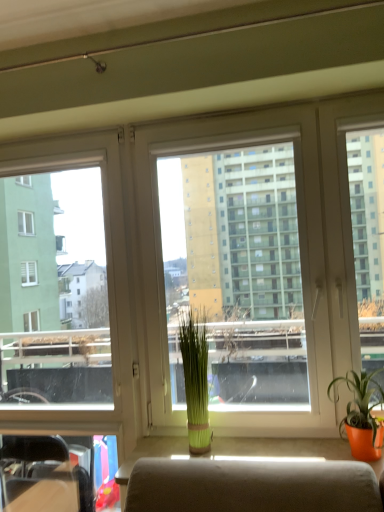
Question: Does transparent plastic window screen at center appear on the left side of green matte plant at center, which ranks as the 2th houseplant in right-to-left order?

Choices:
 (A) no
 (B) yes

Answer: (A)

Question: Is transparent plastic window screen at center to the right of green matte plant at center, the first houseplant viewed from the back, from the viewer's perspective?

Choices:
 (A) yes
 (B) no

Answer: (A)

Question: Is green matte plant at center, which ranks as the 2th houseplant in right-to-left order, inside transparent plastic window screen at center?

Choices:
 (A) yes
 (B) no

Answer: (B)

Question: Can you confirm if transparent plastic window screen at center is bigger than green matte plant at center, the first houseplant viewed from the back?

Choices:
 (A) no
 (B) yes

Answer: (B)

Question: Would you say transparent plastic window screen at center is a long distance from green matte plant at center, marked as the second houseplant in a front-to-back arrangement?

Choices:
 (A) no
 (B) yes

Answer: (A)

Question: From the image's perspective, is transparent plastic window screen at center above or below transparent glass window at left?

Choices:
 (A) below
 (B) above

Answer: (B)

Question: Would you say transparent plastic window screen at center is to the left or to the right of transparent glass window at left in the picture?

Choices:
 (A) left
 (B) right

Answer: (B)

Question: Considering the positions of transparent plastic window screen at center and transparent glass window at left in the image, is transparent plastic window screen at center taller or shorter than transparent glass window at left?

Choices:
 (A) tall
 (B) short

Answer: (B)

Question: From a real-world perspective, is transparent plastic window screen at center positioned above or below transparent glass window at left?

Choices:
 (A) above
 (B) below

Answer: (A)

Question: Looking at their shapes, would you say transparent glass window at left is wider or thinner than green matte plant at center, the first houseplant viewed from the back?

Choices:
 (A) thin
 (B) wide

Answer: (A)

Question: From a real-world perspective, is transparent glass window at left physically located above or below green matte plant at center, the first houseplant viewed from the back?

Choices:
 (A) above
 (B) below

Answer: (A)

Question: In terms of height, does transparent glass window at left look taller or shorter compared to green matte plant at center, which ranks as the 2th houseplant in right-to-left order?

Choices:
 (A) tall
 (B) short

Answer: (A)

Question: Does point (46, 404) appear closer or farther from the camera than point (210, 434)?

Choices:
 (A) closer
 (B) farther

Answer: (B)

Question: Considering the positions of point (352, 420) and point (89, 430), is point (352, 420) closer or farther from the camera than point (89, 430)?

Choices:
 (A) closer
 (B) farther

Answer: (A)

Question: Considering their positions, is matte orange pot at right, which appears as the second houseplant when viewed from the left, located in front of or behind transparent glass window at left?

Choices:
 (A) front
 (B) behind

Answer: (A)